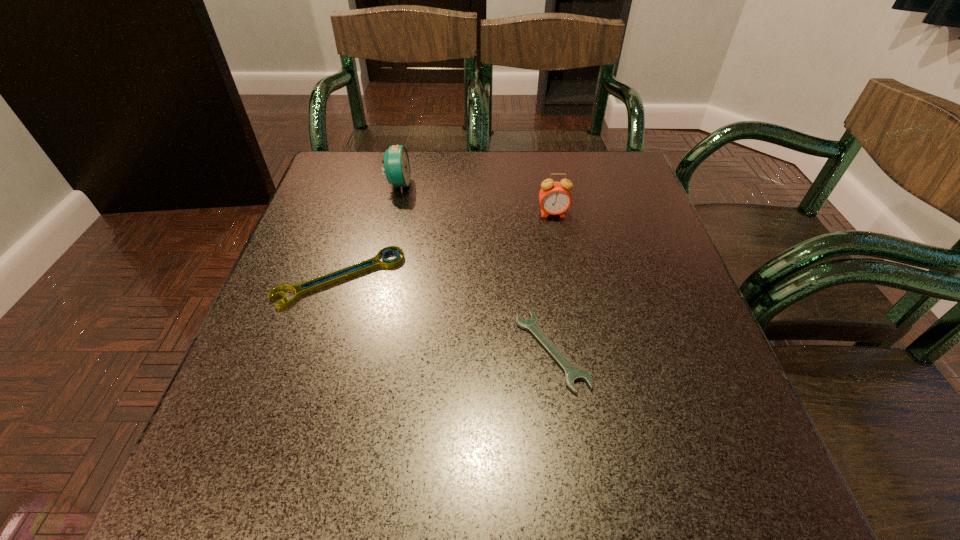
Where is `vacant space at the far right corner of the desktop`? This screenshot has width=960, height=540. vacant space at the far right corner of the desktop is located at coordinates (602, 174).

I want to click on free space between the right alarm clock and the third farthest object, so click(x=446, y=246).

Find the location of a particular element. empty location between the right wrench and the left wrench is located at coordinates (446, 314).

Find the location of `empty space that is in between the right wrench and the right alarm clock`. empty space that is in between the right wrench and the right alarm clock is located at coordinates (552, 282).

Find the location of `vacant point located between the left wrench and the nearer alarm clock`. vacant point located between the left wrench and the nearer alarm clock is located at coordinates (446, 246).

Identify the location of free space between the farther alarm clock and the nearest object. The width and height of the screenshot is (960, 540). (475, 268).

This screenshot has width=960, height=540. What are the coordinates of `free spot between the right alarm clock and the farther alarm clock` in the screenshot? It's located at (475, 199).

This screenshot has width=960, height=540. Identify the location of vacant point located between the farther wrench and the right alarm clock. (446, 246).

Where is `free point between the right alarm clock and the third farthest object`? Image resolution: width=960 pixels, height=540 pixels. free point between the right alarm clock and the third farthest object is located at coordinates (446, 246).

The image size is (960, 540). What are the coordinates of `vacant space that is in between the left wrench and the nearest object` in the screenshot? It's located at (446, 314).